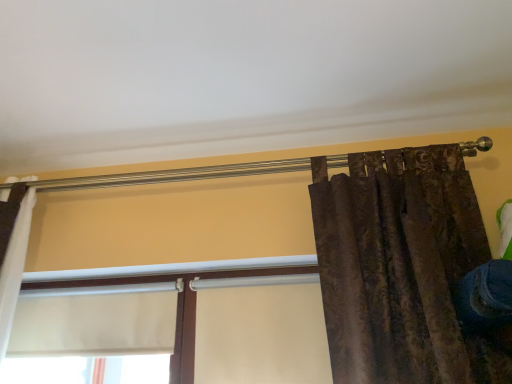
Question: Should I look upward or downward to see white matte window at center, the 2th window positioned from the left?

Choices:
 (A) up
 (B) down

Answer: (B)

Question: Does white matte window at center, the 2th window positioned from the left, turn towards blue denim jeans at lower right?

Choices:
 (A) yes
 (B) no

Answer: (B)

Question: Is white matte window at center, the 2th window positioned from the left, not inside blue denim jeans at lower right?

Choices:
 (A) yes
 (B) no

Answer: (A)

Question: Can you confirm if white matte window at center, acting as the first window starting from the right, is smaller than blue denim jeans at lower right?

Choices:
 (A) yes
 (B) no

Answer: (B)

Question: From the image's perspective, is white matte window at center, acting as the first window starting from the right, under blue denim jeans at lower right?

Choices:
 (A) yes
 (B) no

Answer: (A)

Question: Is white matte window at center, the 2th window positioned from the left, not near blue denim jeans at lower right?

Choices:
 (A) no
 (B) yes

Answer: (A)

Question: Is white matte window at center, the 2th window positioned from the left, to the left of blue denim jeans at lower right from the viewer's perspective?

Choices:
 (A) yes
 (B) no

Answer: (A)

Question: From the image's perspective, is white matte window at center, arranged as the first window when viewed from the left, below white matte window at center, acting as the first window starting from the right?

Choices:
 (A) no
 (B) yes

Answer: (A)

Question: Is white matte window at center, arranged as the first window when viewed from the left, far away from white matte window at center, the 2th window positioned from the left?

Choices:
 (A) no
 (B) yes

Answer: (A)

Question: From a real-world perspective, is white matte window at center, the 2th window positioned from the right, positioned under white matte window at center, the 2th window positioned from the left, based on gravity?

Choices:
 (A) yes
 (B) no

Answer: (B)

Question: Does white matte window at center, the 2th window positioned from the right, touch white matte window at center, acting as the first window starting from the right?

Choices:
 (A) no
 (B) yes

Answer: (A)

Question: Is white matte window at center, the 2th window positioned from the left, at the back of white matte window at center, the 2th window positioned from the right?

Choices:
 (A) no
 (B) yes

Answer: (B)

Question: Is white matte window at center, arranged as the first window when viewed from the left, shorter than white matte window at center, the 2th window positioned from the left?

Choices:
 (A) no
 (B) yes

Answer: (B)

Question: Is white matte window at center, arranged as the first window when viewed from the left, facing towards blue denim jeans at lower right?

Choices:
 (A) yes
 (B) no

Answer: (B)